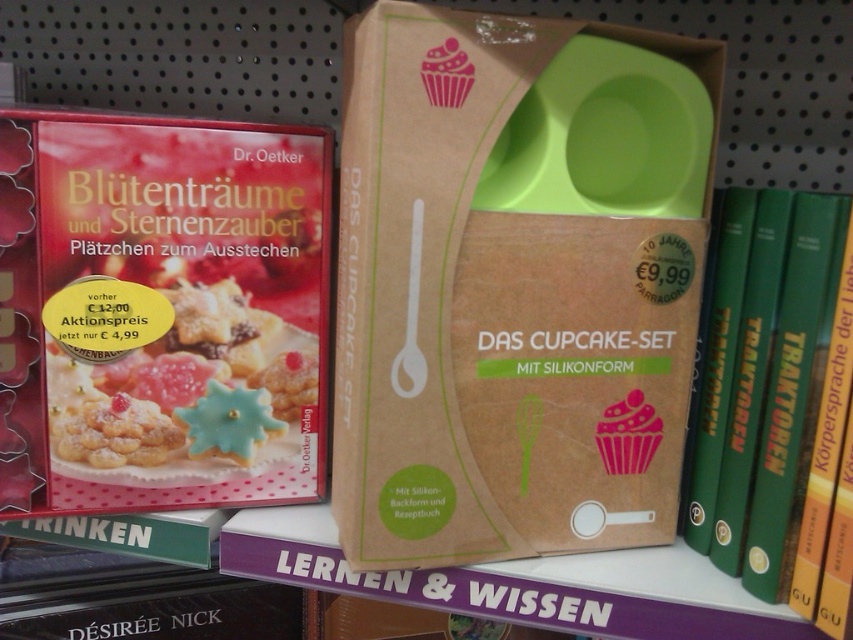
You are a customer in the store and want to know if the green matte book at right can fit into the same shelf space currently occupied by the matte plastic cookies at center. Based on their heights, would the book be taller than the cookies?

The green matte book at right is much taller than the matte plastic cookies at center, so yes, the book is taller and would require more vertical space than the cookies currently occupy.

You are organizing a baking event and have both the matte brown cardboard box at center and the green matte book at right. If you need to place them side by side on a shelf, which item should you place first to ensure they fit without overlapping?

The matte brown cardboard box at center has a larger width than the green matte book at right. Therefore, you should place the matte brown cardboard box at center first to accommodate its greater width, ensuring there is enough space for the smaller green matte book at right afterward.